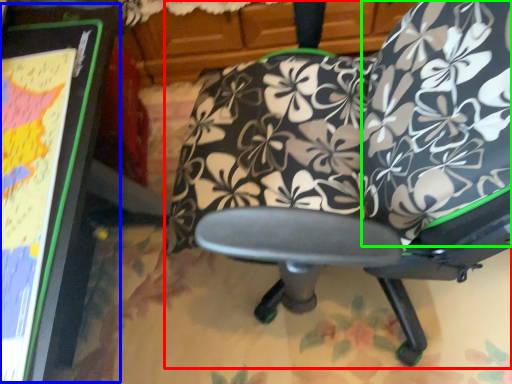
Question: Considering the real-world distances, which object is closest to chair (highlighted by a red box)? bulletin board (highlighted by a blue box) or bean bag chair (highlighted by a green box).

Choices:
 (A) bulletin board
 (B) bean bag chair

Answer: (B)